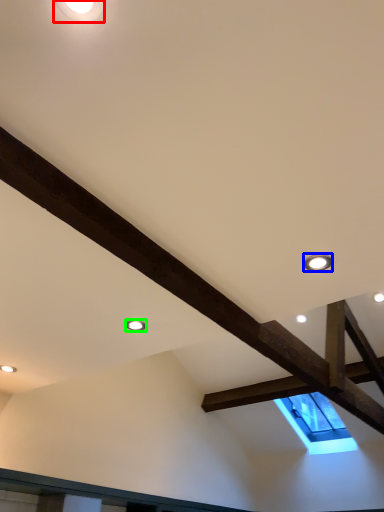
Question: Estimate the real-world distances between objects in this image. Which object is closer to droplight (highlighted by a red box), droplight (highlighted by a blue box) or droplight (highlighted by a green box)?

Choices:
 (A) droplight
 (B) droplight

Answer: (A)